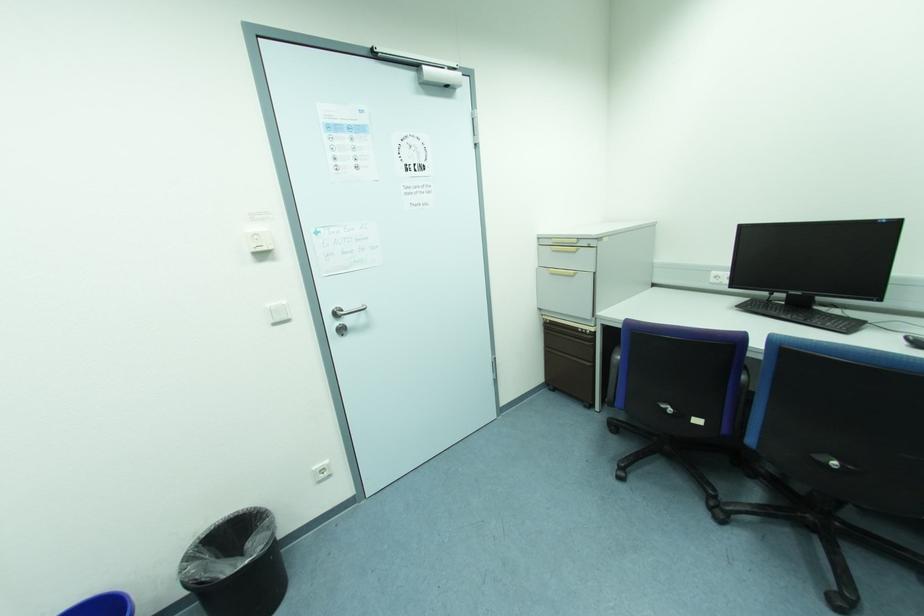
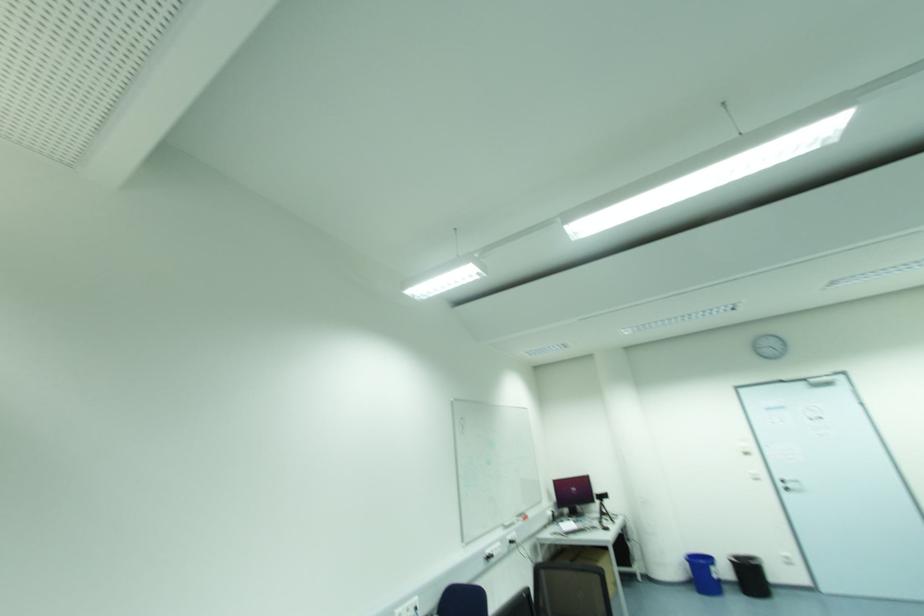
In the second image, find the point that corresponds to point (349, 321) in the first image.

(789, 485)